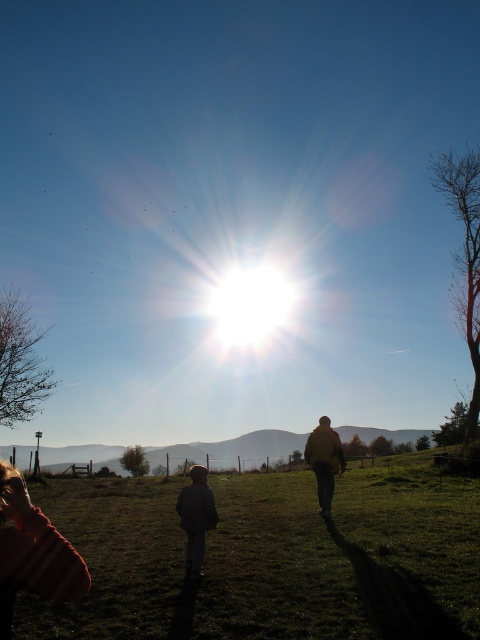
Can you confirm if dark gray jacket at center is shorter than brown leather jacket at center?

Incorrect, dark gray jacket at center's height does not fall short of brown leather jacket at center's.

Can you confirm if dark gray jacket at center is positioned below brown leather jacket at center?

Indeed, dark gray jacket at center is positioned under brown leather jacket at center.

Who is more distant from viewer, (188, 531) or (316, 472)?

The point (316, 472) is behind.

Find the location of `dark gray jacket at center`. dark gray jacket at center is located at coordinates (195, 516).

Which is more to the right, green grass at lower center or brown leather jacket at center?

Positioned to the right is brown leather jacket at center.

Measure the distance between green grass at lower center and brown leather jacket at center.

green grass at lower center is 12.08 feet from brown leather jacket at center.

Identify the location of green grass at lower center. The height and width of the screenshot is (640, 480). (271, 557).

Locate an element on the screen. The width and height of the screenshot is (480, 640). green grass at lower center is located at coordinates coord(271,557).

Image resolution: width=480 pixels, height=640 pixels. I want to click on green grass at lower center, so click(271, 557).